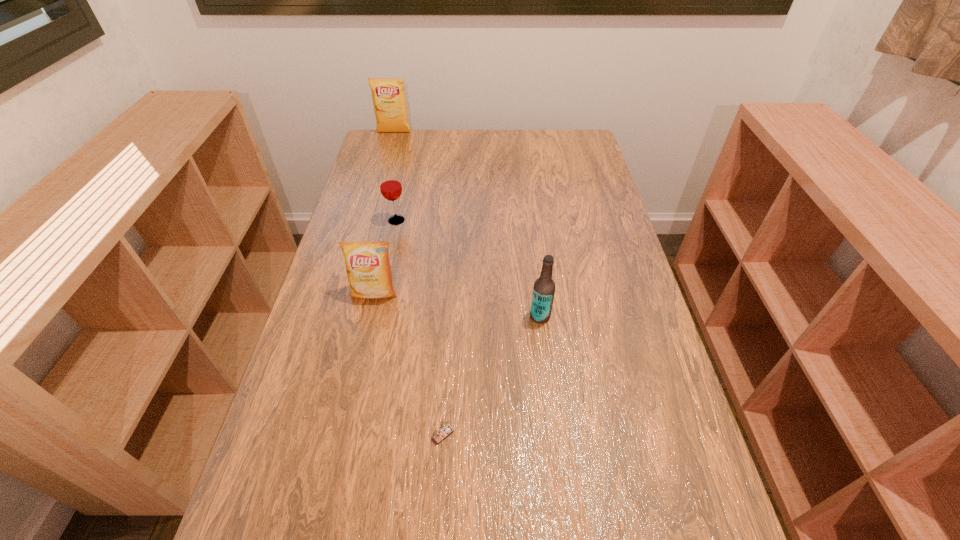
Where is `the farthest object`? Image resolution: width=960 pixels, height=540 pixels. the farthest object is located at coordinates (388, 94).

Find the location of `the taller crisp (potato chip)`. the taller crisp (potato chip) is located at coordinates (388, 94).

This screenshot has height=540, width=960. What are the coordinates of `beer bottle` in the screenshot? It's located at (544, 287).

I want to click on the rightmost object, so click(x=544, y=287).

The height and width of the screenshot is (540, 960). I want to click on the third nearest object, so click(x=368, y=268).

I want to click on the shorter crisp (potato chip), so click(368, 268).

Where is `glass`? The height and width of the screenshot is (540, 960). glass is located at coordinates (390, 184).

The height and width of the screenshot is (540, 960). Identify the location of the shortest object. (444, 431).

You are a GUI agent. You are given a task and a screenshot of the screen. Output one action in this format:
    pyautogui.click(x=<x>, y=<y>)
    Task: Click on the nearest object
    This screenshot has width=960, height=540.
    Given the screenshot: What is the action you would take?
    pyautogui.click(x=444, y=431)

Find the location of a particular element. free space located on the front of the taller crisp (potato chip) with the logo is located at coordinates (386, 159).